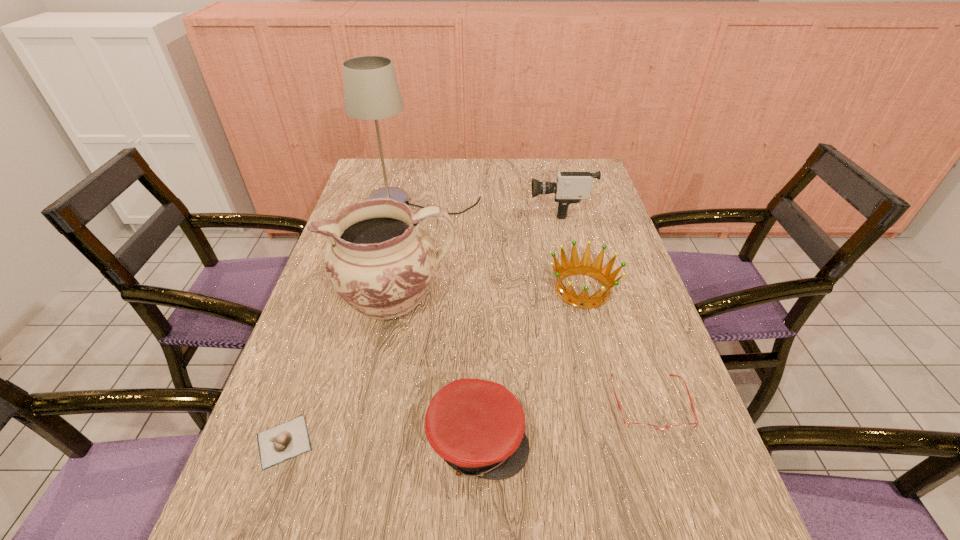
Locate an element on the screen. The image size is (960, 540). the tallest object is located at coordinates (371, 92).

Image resolution: width=960 pixels, height=540 pixels. I want to click on the sixth shortest object, so (x=379, y=258).

Locate an element on the screen. This screenshot has height=540, width=960. the fifth shortest object is located at coordinates (570, 187).

At what (x,y) coordinates should I click in order to perform the action: click on crown. Please return your answer as a coordinate pair (x, y). This screenshot has height=540, width=960. Looking at the image, I should click on (575, 267).

The image size is (960, 540). I want to click on cap, so click(x=477, y=426).

You are a GUI agent. You are given a task and a screenshot of the screen. Output one action in this format:
    pyautogui.click(x=<x>, y=<y>)
    Task: Click on the sixth tallest object
    
    Given the screenshot: What is the action you would take?
    pyautogui.click(x=637, y=427)

The width and height of the screenshot is (960, 540). What are the coordinates of `garlic` in the screenshot? It's located at (278, 444).

Find the location of `vacant space located on the right of the tallest object`. vacant space located on the right of the tallest object is located at coordinates (540, 204).

I want to click on vacant space located 0.050m on the spout of the sixth shortest object, so click(x=314, y=297).

Find the location of a particular element. This screenshot has width=960, height=540. free spot located 0.150m on the recording direction of the fifth shortest object is located at coordinates (484, 209).